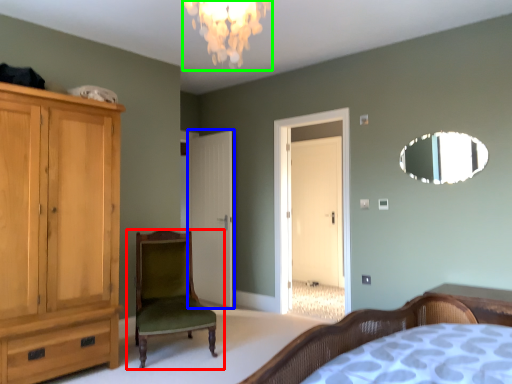
Question: Which is nearer to the chair (highlighted by a red box)? door (highlighted by a blue box) or light fixture (highlighted by a green box).

Choices:
 (A) door
 (B) light fixture

Answer: (A)